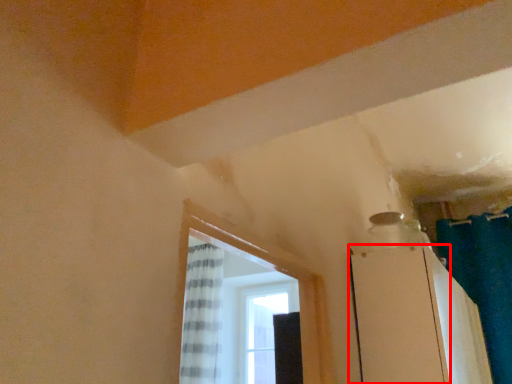
Question: From the image, what is the correct spatial relationship of screen door (annotated by the red box) in relation to shower curtain?

Choices:
 (A) right
 (B) left

Answer: (B)